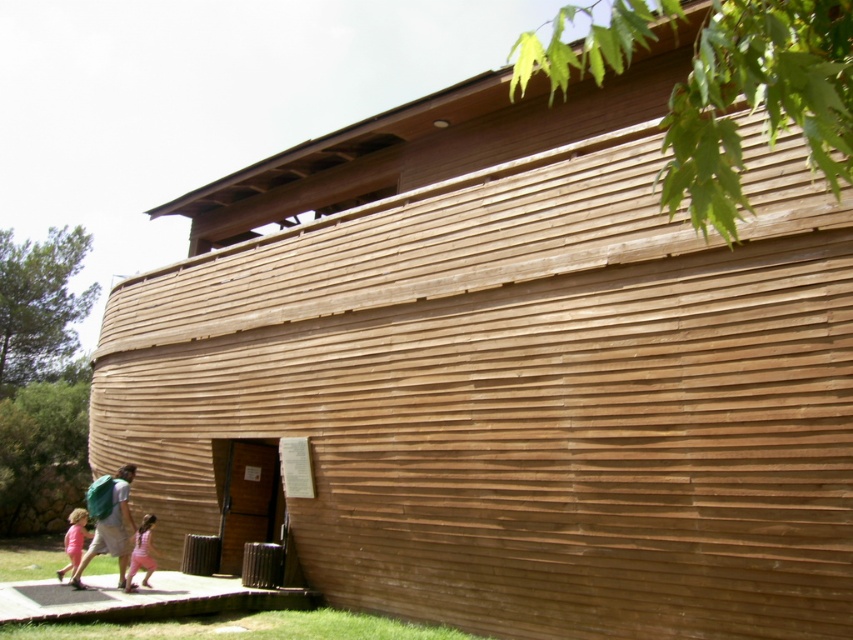
You are standing at the entrance of the wooden ship structure and notice two items near the base of the building. The items are the matte brown backpack at lower left and the pink fabric dress at lower center. Which item is taller?

The matte brown backpack at lower left is taller than the pink fabric dress at lower center according to the description.

You are standing at the entrance of the ship structure and want to take a photo of the point marked at coordinates point (142, 561). Given that your camera has a maximum focus range of 30 feet, will you be able to capture it clearly?

The point (142, 561) is 29.37 feet away from the viewer, which is within the camera maximum focus range of 30 feet. So yes, you can capture it clearly.